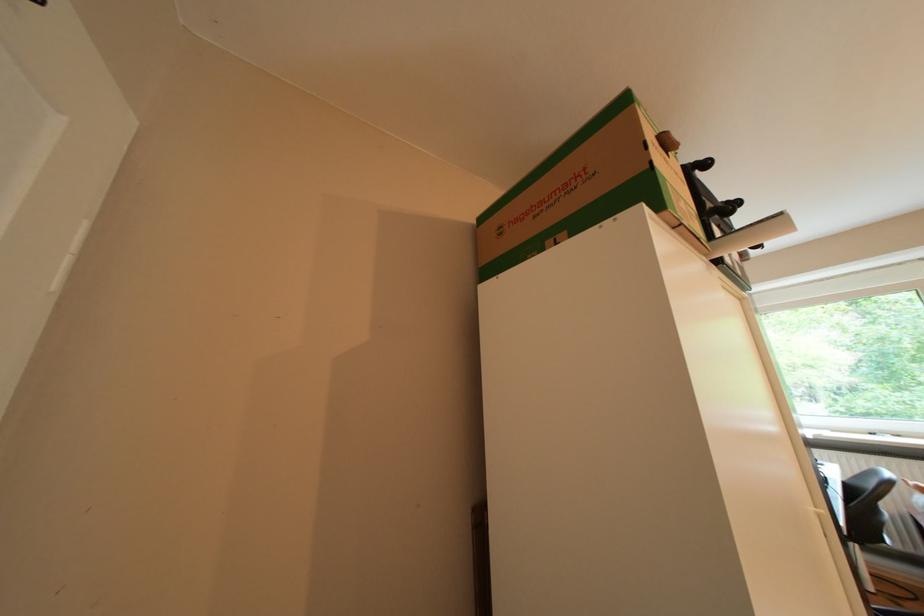
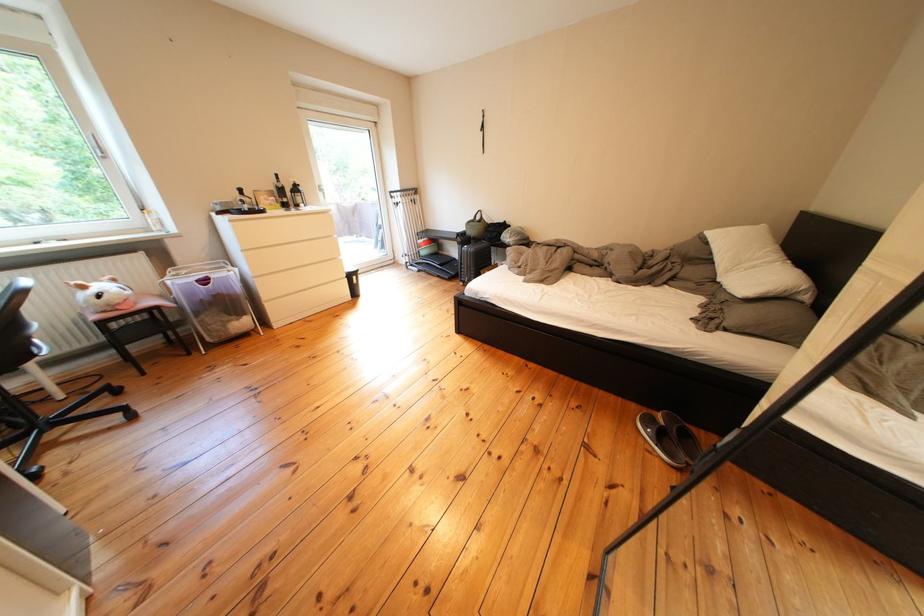
Based on the continuous images, in which direction is the camera rotating?

The camera's rotation is toward right-down.